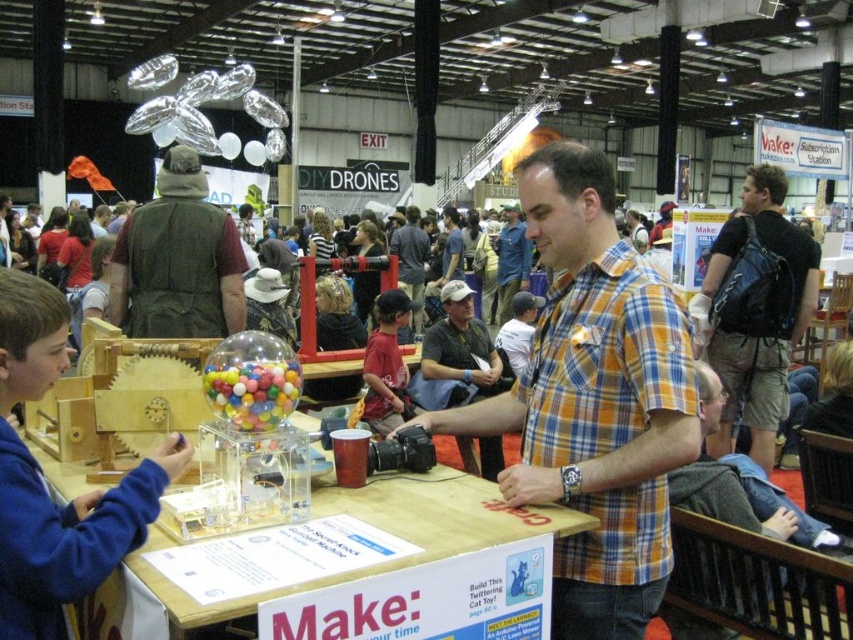
Can you confirm if plaid cotton shirt at center is positioned to the left of plaid shirt at center?

Incorrect, plaid cotton shirt at center is not on the left side of plaid shirt at center.

Measure the distance between point (555, 179) and camera.

A distance of 2.25 meters exists between point (555, 179) and camera.

Between point (642, 515) and point (415, 330), which one is positioned behind?

The point (415, 330) is behind.

Where is `plaid cotton shirt at center`? This screenshot has width=853, height=640. plaid cotton shirt at center is located at coordinates (595, 401).

Who is positioned more to the left, transparent acrylic table at center or green fabric vest at upper left?

green fabric vest at upper left

Between point (445, 547) and point (132, 296), which one is positioned in front?

Point (445, 547)

Is point (450, 509) in front of point (131, 221)?

Yes, it is in front of point (131, 221).

The height and width of the screenshot is (640, 853). I want to click on transparent acrylic table at center, so click(x=384, y=531).

Does blue fleece jacket at center have a greater width compared to black leather backpack at right?

No, blue fleece jacket at center is not wider than black leather backpack at right.

Does point (45, 522) lie in front of point (811, 296)?

Yes, point (45, 522) is in front of point (811, 296).

Between point (22, 365) and point (799, 289), which one is positioned in front?

Point (22, 365) is more forward.

I want to click on blue fleece jacket at center, so click(x=45, y=484).